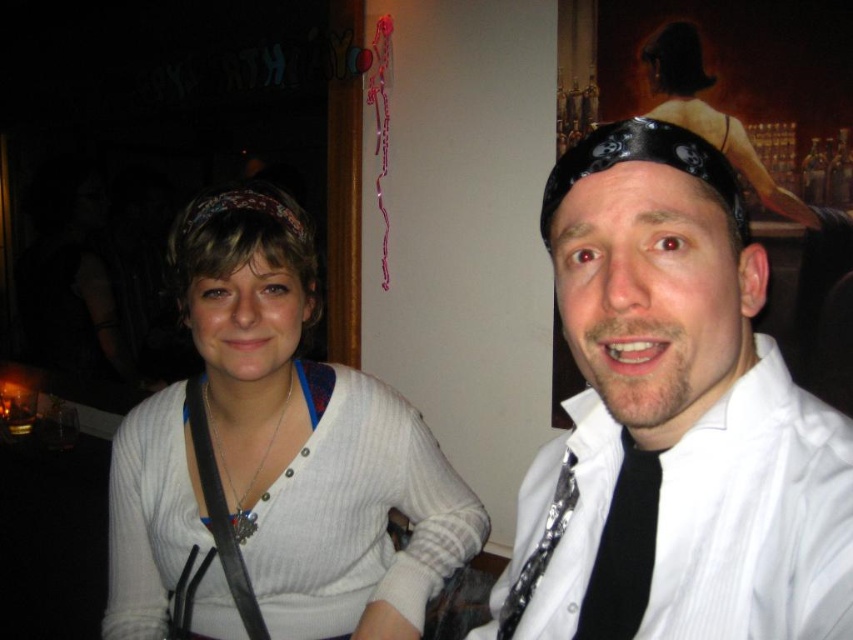
Does white ribbed sweater at center have a smaller size compared to black satin tie at center?

No.

Describe the element at coordinates (276, 458) in the screenshot. I see `white ribbed sweater at center` at that location.

What do you see at coordinates (276, 458) in the screenshot?
I see `white ribbed sweater at center` at bounding box center [276, 458].

This screenshot has width=853, height=640. In order to click on white ribbed sweater at center in this screenshot , I will do `click(276, 458)`.

Who is shorter, black satin tie at center or shiny silver tie at right?

A: black satin tie at center is shorter.

Who is higher up, black satin tie at center or shiny silver tie at right?

black satin tie at center

Find the location of a particular element. The width and height of the screenshot is (853, 640). black satin tie at center is located at coordinates (624, 548).

Is white glossy shirt at upper right bigger than shiny silver tie at right?

Yes.

Which is in front, point (598, 548) or point (572, 480)?

Point (598, 548)

The width and height of the screenshot is (853, 640). Identify the location of white glossy shirt at upper right. (672, 420).